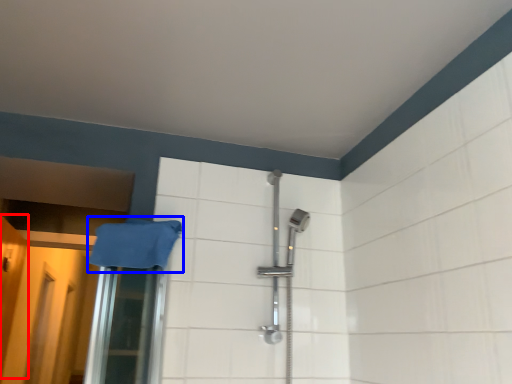
Question: Among these objects, which one is nearest to the camera, door (highlighted by a red box) or bath towel (highlighted by a blue box)?

Choices:
 (A) door
 (B) bath towel

Answer: (B)